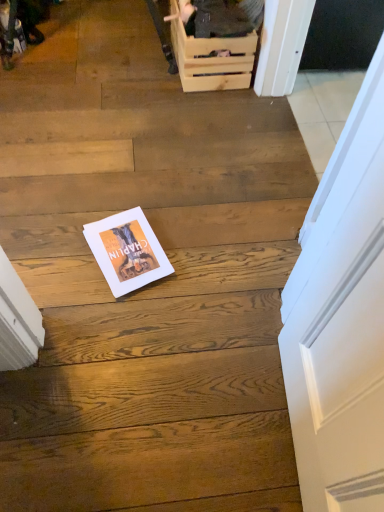
Question: From the image's perspective, is wooden crate at upper center below white paper magazine at center?

Choices:
 (A) no
 (B) yes

Answer: (A)

Question: Does wooden crate at upper center have a lesser height compared to white paper magazine at center?

Choices:
 (A) no
 (B) yes

Answer: (A)

Question: Is wooden crate at upper center not inside white paper magazine at center?

Choices:
 (A) no
 (B) yes

Answer: (B)

Question: Is wooden crate at upper center with white paper magazine at center?

Choices:
 (A) yes
 (B) no

Answer: (B)

Question: Can you confirm if wooden crate at upper center is taller than white paper magazine at center?

Choices:
 (A) no
 (B) yes

Answer: (B)

Question: Can you confirm if wooden crate at upper center is smaller than white paper magazine at center?

Choices:
 (A) yes
 (B) no

Answer: (B)

Question: Is wooden crate at upper center surrounding white paper magazine at center?

Choices:
 (A) no
 (B) yes

Answer: (A)

Question: Can you confirm if wooden crate at upper center is wider than white paper magazine at center?

Choices:
 (A) yes
 (B) no

Answer: (B)

Question: Is wooden crate at upper center located outside white paper magazine at center?

Choices:
 (A) no
 (B) yes

Answer: (B)

Question: Is the position of wooden crate at upper center more distant than that of white paper magazine at center?

Choices:
 (A) yes
 (B) no

Answer: (A)

Question: Is wooden crate at upper center at the right side of white paper magazine at center?

Choices:
 (A) yes
 (B) no

Answer: (A)

Question: Is wooden crate at upper center turned away from white paper magazine at center?

Choices:
 (A) yes
 (B) no

Answer: (B)

Question: From a real-world perspective, does white paper magazine at center sit lower than wooden crate at upper center?

Choices:
 (A) no
 (B) yes

Answer: (B)